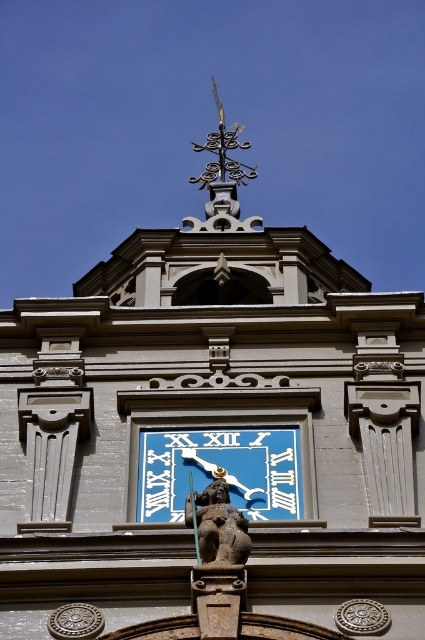
You are standing in front of a building and see a point at coordinates (217, 524). What object is located at that point?

The point at coordinates (217, 524) indicates the brown stone lion at center.

You are an architect inspecting the building facade. You notice the brown stone lion at center and the polished brass weather vane at upper center. Which object appears smaller in size?

The brown stone lion at center appears smaller in size compared to the polished brass weather vane at upper center.

You are an architect examining the building facade. You notice the brown stone lion at center and the polished brass weather vane at upper center. Which object has a smaller width?

The brown stone lion at center is thinner than the polished brass weather vane at upper center, so the brown stone lion at center has a smaller width.